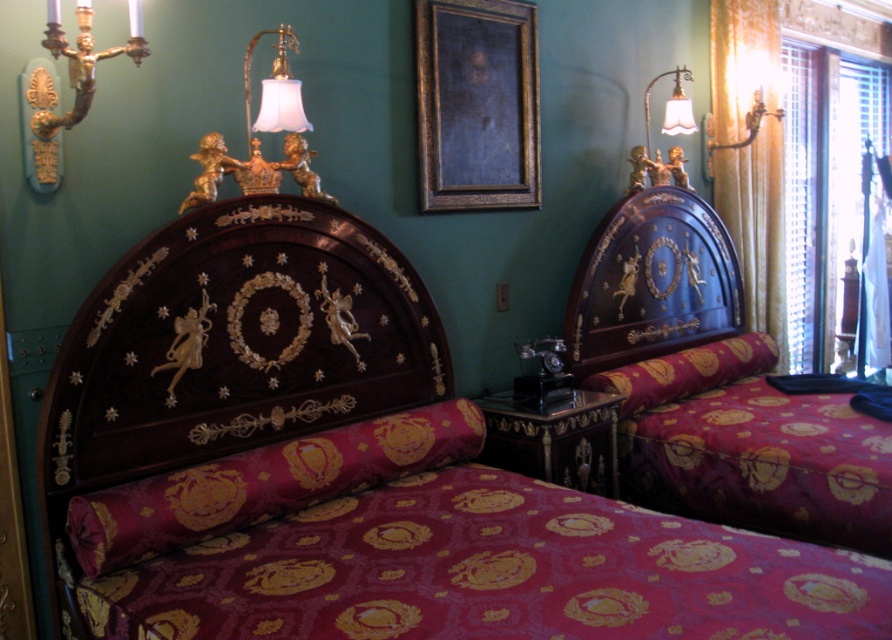
Question: Estimate the real-world distances between objects in this image. Which object is farther from the gold-bronze sconce at upper left?

Choices:
 (A) velvet burgundy pillow at center
 (B) polished dark wood bed at left
 (C) yellow sheer curtain at right

Answer: (C)

Question: Which point is farther from the camera taking this photo?

Choices:
 (A) (449, 372)
 (B) (683, 124)

Answer: (B)

Question: Is velvet burgundy pillow at center in front of white fabric lampshade at upper right?

Choices:
 (A) no
 (B) yes

Answer: (B)

Question: Is velvet burgundy bedspread at lower center positioned in front of matte dark wood bed at right?

Choices:
 (A) yes
 (B) no

Answer: (A)

Question: Among these objects, which one is farthest from the camera?

Choices:
 (A) dark blue matte picture frame at upper center
 (B) blue glossy headboard at upper right
 (C) gold-bronze sconce at upper left

Answer: (B)

Question: Does dark wood/marquetry headboard at left have a greater width compared to white fabric lampshade at upper right?

Choices:
 (A) yes
 (B) no

Answer: (A)